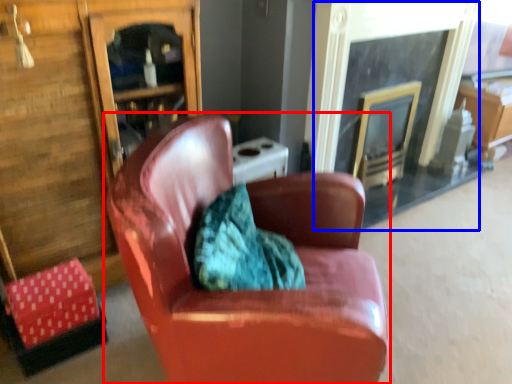
Question: Which object appears farthest to the camera in this image, chair (highlighted by a red box) or fireplace (highlighted by a blue box)?

Choices:
 (A) chair
 (B) fireplace

Answer: (B)